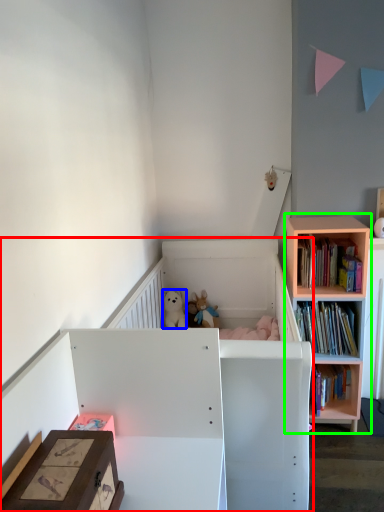
Question: Which is nearer to the infant bed (highlighted by a red box)? animal (highlighted by a blue box) or shelf (highlighted by a green box).

Choices:
 (A) animal
 (B) shelf

Answer: (B)